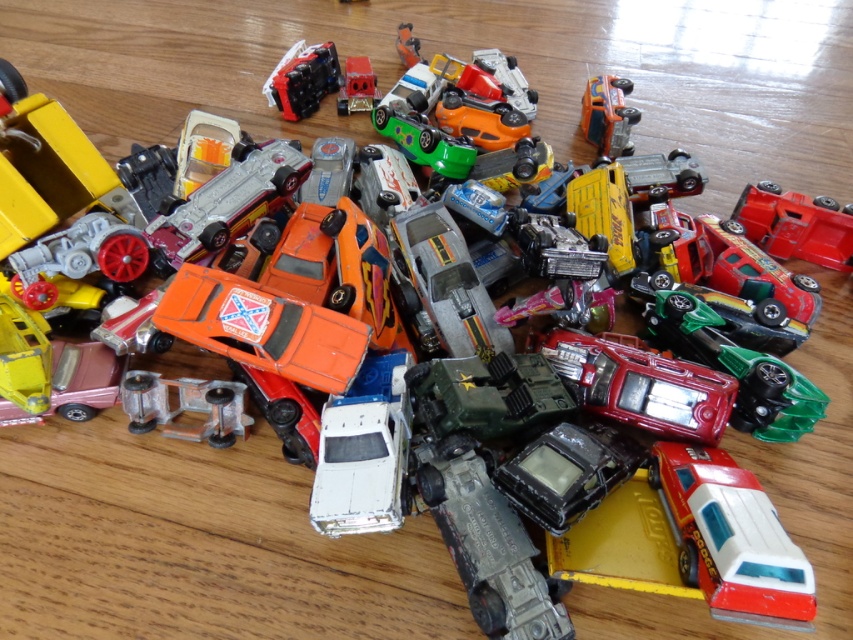
Question: Is shiny plastic car at upper center thinner than shiny orange car at upper right?

Choices:
 (A) no
 (B) yes

Answer: (A)

Question: Among these points, which one is farthest from the camera?

Choices:
 (A) click(x=264, y=83)
 (B) click(x=590, y=80)
 (C) click(x=833, y=212)

Answer: (A)

Question: Among these objects, which one is farthest from the camera?

Choices:
 (A) shiny orange car at upper right
 (B) shiny plastic car at upper center
 (C) shiny red truck at center

Answer: (B)

Question: Can you confirm if shiny red truck at center is positioned to the left of shiny plastic car at upper center?

Choices:
 (A) yes
 (B) no

Answer: (B)

Question: Which object is positioned closest to the shiny orange car at upper right?

Choices:
 (A) shiny red truck at center
 (B) shiny plastic car at upper center

Answer: (A)

Question: Is shiny plastic car at upper center to the right of shiny orange car at upper right from the viewer's perspective?

Choices:
 (A) yes
 (B) no

Answer: (B)